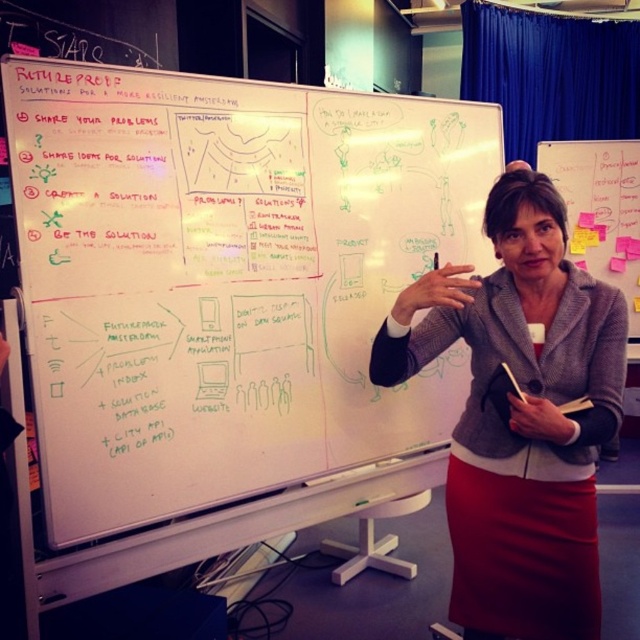
Question: From the image, what is the correct spatial relationship of whiteboard at upper center in relation to gray woolen blazer at center?

Choices:
 (A) below
 (B) above

Answer: (B)

Question: Considering the relative positions of whiteboard at upper center and gray woolen blazer at center in the image provided, where is whiteboard at upper center located with respect to gray woolen blazer at center?

Choices:
 (A) below
 (B) above

Answer: (B)

Question: Which of the following is the closest to the observer?

Choices:
 (A) (593, 634)
 (B) (26, 243)

Answer: (B)

Question: Which object is closer to the camera taking this photo?

Choices:
 (A) whiteboard at upper center
 (B) gray woolen blazer at center

Answer: (A)

Question: Does whiteboard at upper center appear on the left side of gray woolen blazer at center?

Choices:
 (A) yes
 (B) no

Answer: (A)

Question: Which of the following is the farthest from the observer?

Choices:
 (A) (241, 81)
 (B) (576, 301)

Answer: (A)